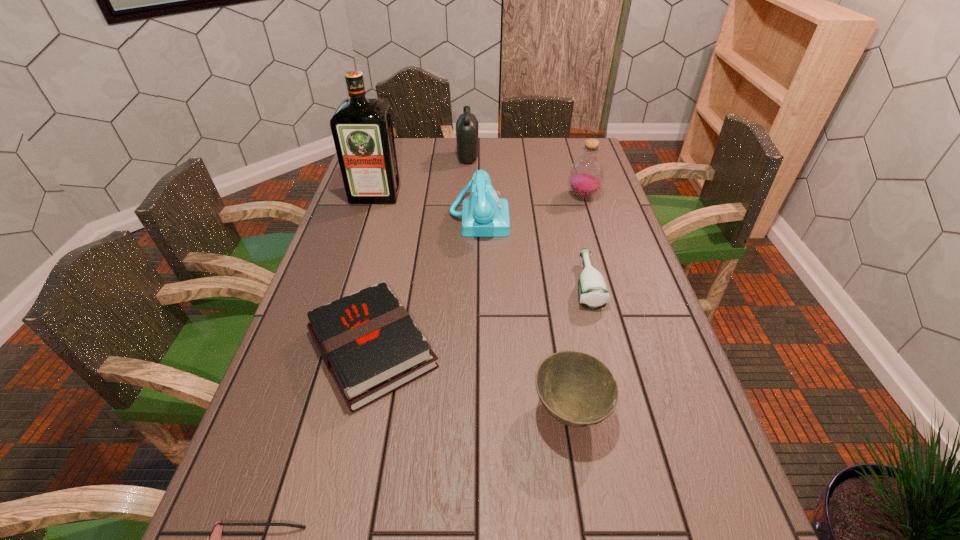
Find the location of `free spot located 0.240m on the left of the second farthest bottle`. free spot located 0.240m on the left of the second farthest bottle is located at coordinates (497, 196).

Identify the location of free space located 0.100m on the dial of the telephone. (540, 218).

This screenshot has height=540, width=960. Find the location of `blank space located on the left of the fifth tallest object`. blank space located on the left of the fifth tallest object is located at coordinates tap(443, 411).

Locate an element on the screen. The height and width of the screenshot is (540, 960). free region located 0.050m on the left of the shortest bottle is located at coordinates (555, 285).

This screenshot has width=960, height=540. Find the location of `free location located 0.190m on the right of the hardback book`. free location located 0.190m on the right of the hardback book is located at coordinates (520, 349).

Locate an element on the screen. This screenshot has height=540, width=960. object that is at the far edge is located at coordinates (467, 125).

This screenshot has width=960, height=540. I want to click on liquor located in the left edge section of the desktop, so click(362, 129).

Where is `hardback book situated at the left edge`? hardback book situated at the left edge is located at coordinates (369, 343).

Where is `free space at the left edge`? This screenshot has height=540, width=960. free space at the left edge is located at coordinates (281, 374).

This screenshot has height=540, width=960. In order to click on free space at the right edge of the desktop in this screenshot , I will do point(656,395).